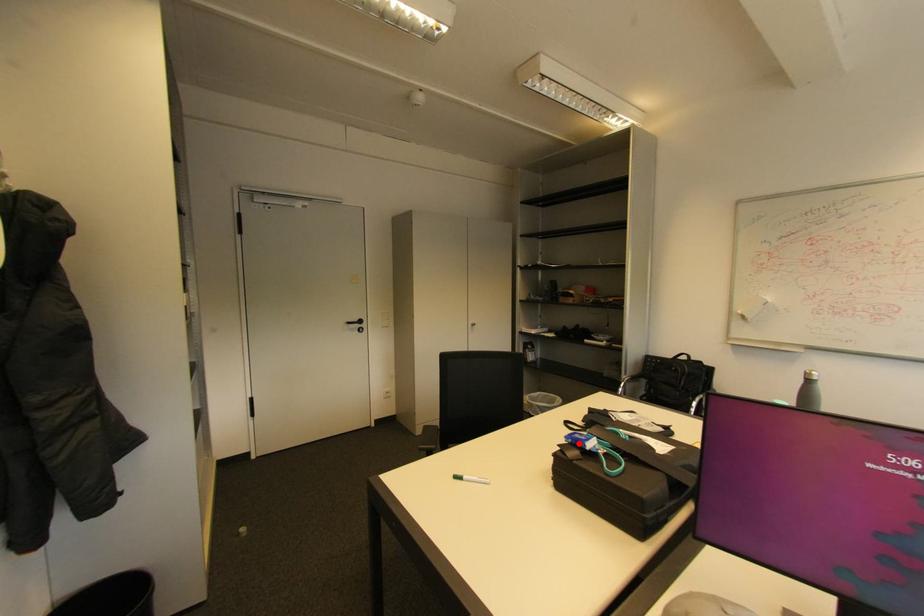
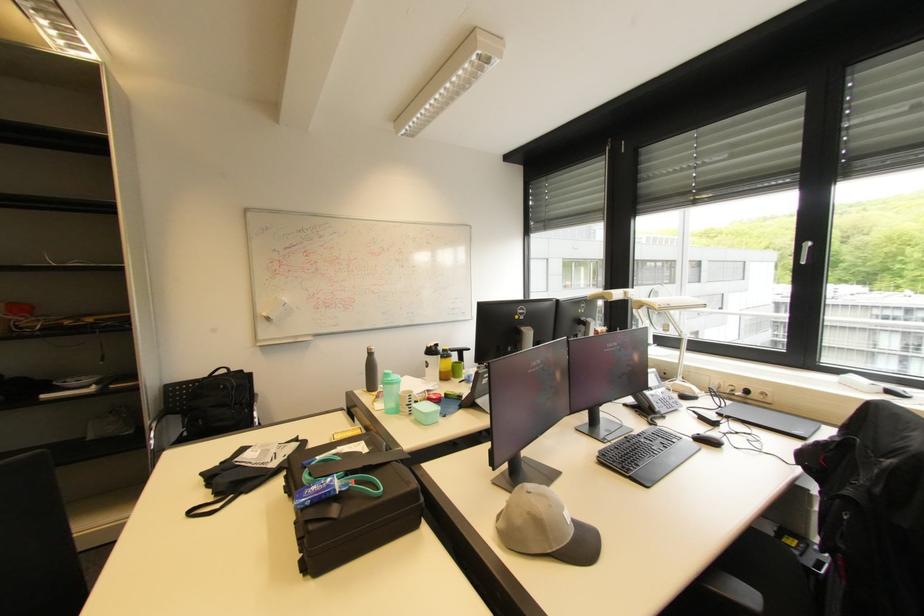
Question: I am providing you with two images of the same scene from different viewpoints. In image1, a red point is highlighted. Considering the same 3D point in image2, which of the following is correct?

Choices:
 (A) It is closer
 (B) It is farther

Answer: (B)